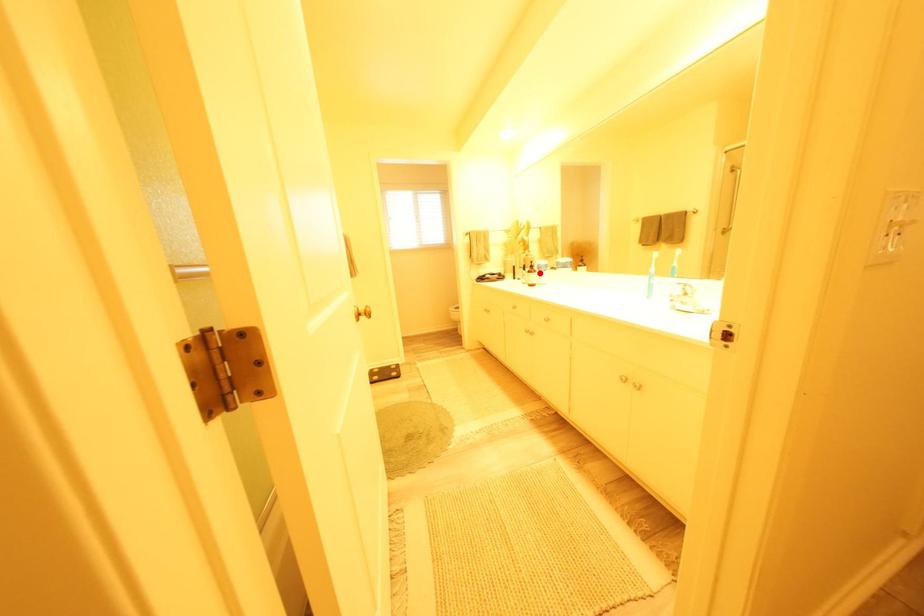
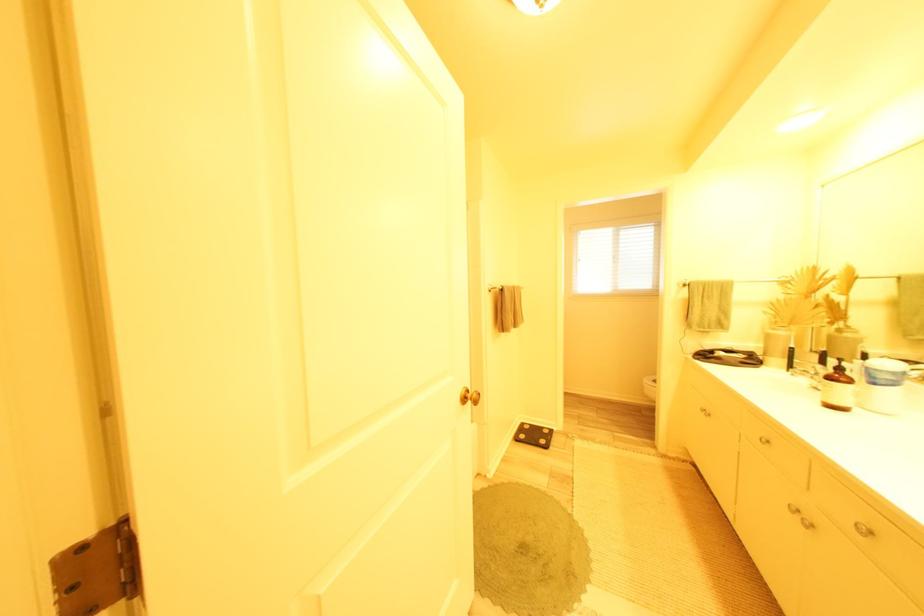
Question: I am providing you with two images of the same scene from different viewpoints. Image1 has a red point marked. In image2, the corresponding 3D location appears at what relative position? Reply with the corresponding letter.

Choices:
 (A) Closer
 (B) Farther

Answer: (B)